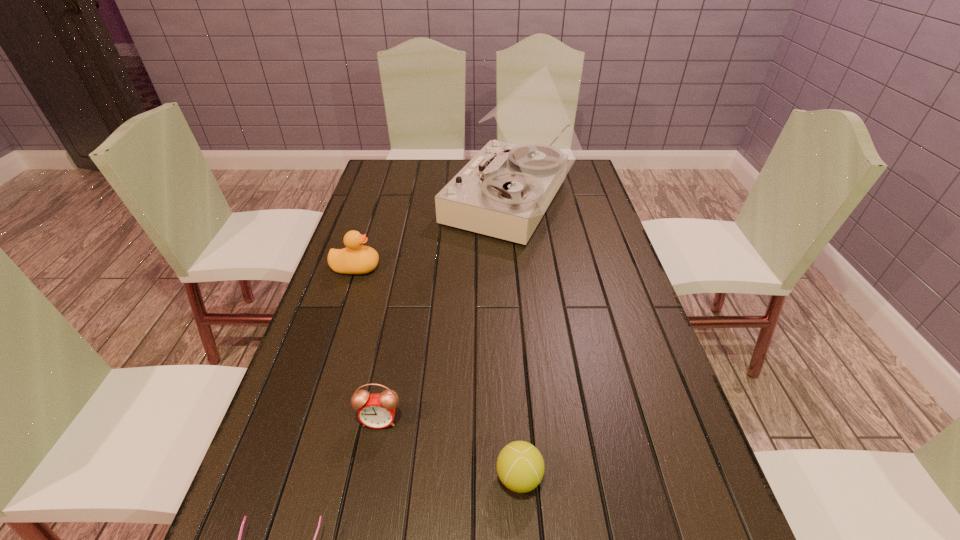
Where is `free area in between the duck and the tallest object`? The height and width of the screenshot is (540, 960). free area in between the duck and the tallest object is located at coordinates (434, 235).

Identify the location of free space between the duck and the second shortest object. The height and width of the screenshot is (540, 960). (438, 373).

Find the location of a particular element. free space between the duck and the tennis ball is located at coordinates (438, 373).

Where is `free space between the third farthest object and the duck`? free space between the third farthest object and the duck is located at coordinates (368, 344).

Where is `free space between the alarm clock and the duck`? The width and height of the screenshot is (960, 540). free space between the alarm clock and the duck is located at coordinates pos(368,344).

The height and width of the screenshot is (540, 960). Identify the location of free space between the alarm clock and the second shortest object. pos(449,449).

Point out which object is positioned as the nearest to the duck. Please provide its 2D coordinates. Your answer should be formatted as a tuple, i.e. [(x, y)], where the tuple contains the x and y coordinates of a point satisfying the conditions above.

[(505, 189)]

Find the location of a particular element. Image resolution: width=960 pixels, height=540 pixels. the fourth closest object relative to the nearest object is located at coordinates (505, 189).

This screenshot has width=960, height=540. In order to click on free location that satisfies the following two spatial constraints: 1. on the back side of the fourth tallest object; 2. on the face of the duck in this screenshot , I will do `click(505, 267)`.